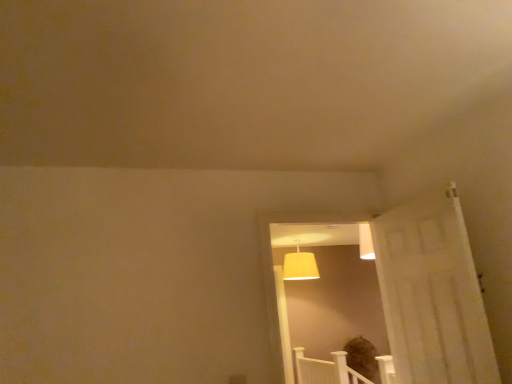
Question: From a real-world perspective, is matte white door at center below yellow fabric lampshade at upper center?

Choices:
 (A) yes
 (B) no

Answer: (A)

Question: Is matte white door at center aimed at yellow fabric lampshade at upper center?

Choices:
 (A) yes
 (B) no

Answer: (B)

Question: From the image's perspective, is matte white door at center on yellow fabric lampshade at upper center?

Choices:
 (A) no
 (B) yes

Answer: (B)

Question: Does matte white door at center have a lesser height compared to yellow fabric lampshade at upper center?

Choices:
 (A) no
 (B) yes

Answer: (A)

Question: Is matte white door at center behind yellow fabric lampshade at upper center?

Choices:
 (A) no
 (B) yes

Answer: (A)

Question: Is matte white door at center turned away from yellow fabric lampshade at upper center?

Choices:
 (A) yes
 (B) no

Answer: (A)

Question: Is yellow fabric lampshade at upper center facing towards matte white door at center?

Choices:
 (A) no
 (B) yes

Answer: (B)

Question: Is yellow fabric lampshade at upper center directly adjacent to matte white door at center?

Choices:
 (A) no
 (B) yes

Answer: (A)

Question: Does yellow fabric lampshade at upper center have a lesser height compared to matte white door at center?

Choices:
 (A) yes
 (B) no

Answer: (A)

Question: Does yellow fabric lampshade at upper center have a greater height compared to matte white door at center?

Choices:
 (A) yes
 (B) no

Answer: (B)

Question: Does yellow fabric lampshade at upper center come in front of matte white door at center?

Choices:
 (A) no
 (B) yes

Answer: (A)

Question: Is yellow fabric lampshade at upper center at the left side of matte white door at center?

Choices:
 (A) no
 (B) yes

Answer: (A)

Question: From a real-world perspective, is yellow fabric lampshade at upper center above or below matte white door at center?

Choices:
 (A) below
 (B) above

Answer: (B)